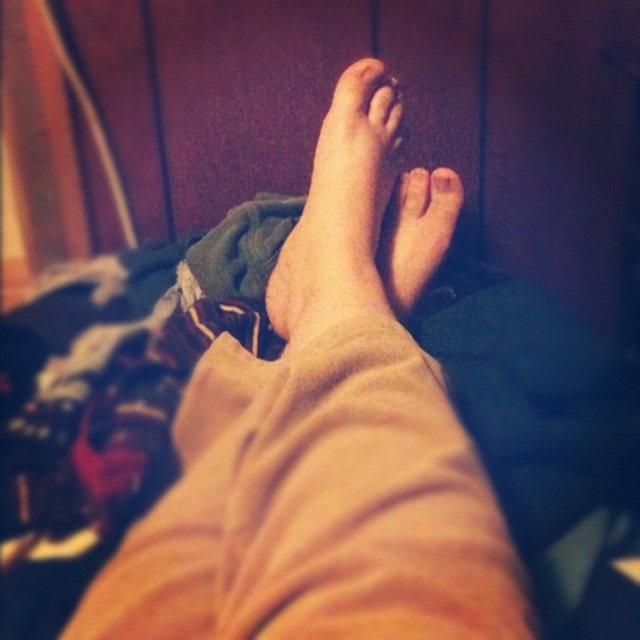
You are a physical therapist evaluating the posture of the person in the image. You need to determine which part, the skinny beige foot at center or the smooth skin toe at center, is positioned higher relative to the other. Based on the image, which one is taller?

The skinny beige foot at center is taller than the smooth skin toe at center.

You are a photographer setting up a shoot in the scene described. You need to place a small prop exactly at the coordinates given in the Objects Description. The prop must be placed on the wooden surface where the skinny beige foot at center is resting. Can you confirm the exact location to place the prop?

The exact coordinates to place the prop on the wooden surface where the skinny beige foot at center is resting are at point (339, 220).

You are a physical therapist analyzing the posture of the person in the image. You need to determine if the skinny beige foot at center is positioned higher than the matte skin toe at center. Based on the provided scene description, can you confirm this?

Yes, the skinny beige foot at center has a greater height compared to the matte skin toe at center, so the foot is positioned higher than the toe.